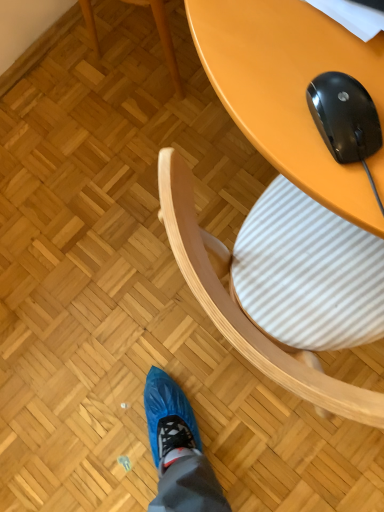
Question: Does wooden chair at upper center come behind black glossy mouse at upper right?

Choices:
 (A) no
 (B) yes

Answer: (B)

Question: Considering the relative sizes of wooden chair at upper center and black glossy mouse at upper right in the image provided, is wooden chair at upper center shorter than black glossy mouse at upper right?

Choices:
 (A) yes
 (B) no

Answer: (B)

Question: Would you say wooden chair at upper center contains black glossy mouse at upper right?

Choices:
 (A) no
 (B) yes

Answer: (A)

Question: From the image's perspective, is wooden chair at upper center above black glossy mouse at upper right?

Choices:
 (A) no
 (B) yes

Answer: (B)

Question: From a real-world perspective, is wooden chair at upper center physically below black glossy mouse at upper right?

Choices:
 (A) yes
 (B) no

Answer: (A)

Question: Can we say wooden chair at upper center lies outside black glossy mouse at upper right?

Choices:
 (A) no
 (B) yes

Answer: (B)

Question: From a real-world perspective, is black glossy mouse at upper right physically below wooden chair at upper center?

Choices:
 (A) yes
 (B) no

Answer: (B)

Question: Can you confirm if black glossy mouse at upper right is positioned to the right of wooden chair at upper center?

Choices:
 (A) no
 (B) yes

Answer: (B)

Question: Is black glossy mouse at upper right bigger than wooden chair at upper center?

Choices:
 (A) no
 (B) yes

Answer: (A)

Question: Can you confirm if black glossy mouse at upper right is wider than wooden chair at upper center?

Choices:
 (A) no
 (B) yes

Answer: (A)

Question: Does black glossy mouse at upper right turn towards wooden chair at upper center?

Choices:
 (A) yes
 (B) no

Answer: (B)

Question: Does black glossy mouse at upper right have a smaller size compared to wooden chair at upper center?

Choices:
 (A) yes
 (B) no

Answer: (A)

Question: Which is correct: black glossy mouse at upper right is inside wooden chair at upper center, or outside of it?

Choices:
 (A) inside
 (B) outside

Answer: (B)